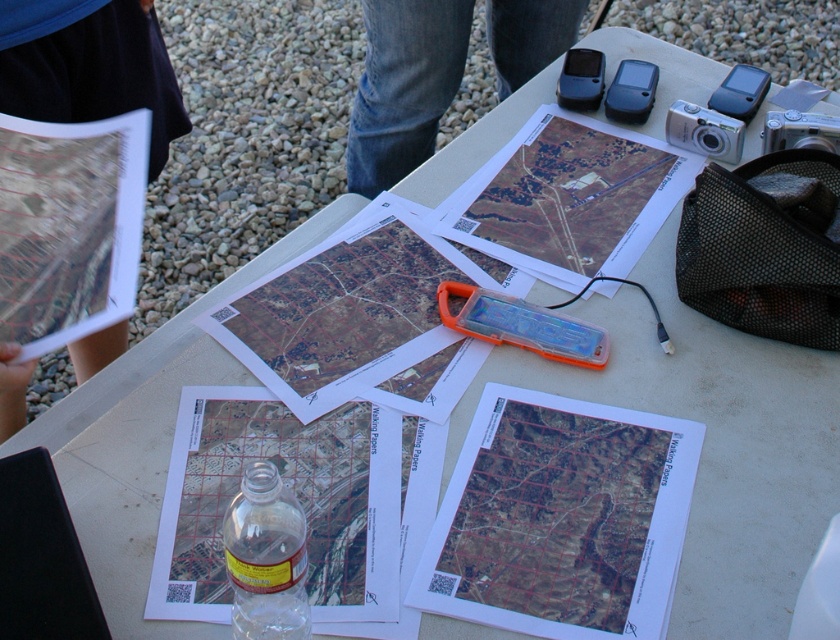
Describe the element at coordinates (571, 196) in the screenshot. I see `matte paper map at upper center` at that location.

Is matte paper map at upper center to the left of black fabric map at upper left from the viewer's perspective?

Incorrect, matte paper map at upper center is not on the left side of black fabric map at upper left.

Which is behind, point (588, 177) or point (151, 161)?

The point (151, 161) is behind.

Locate an element on the screen. The image size is (840, 640). matte paper map at upper center is located at coordinates tap(571, 196).

Does jeans at center appear over translucent orange case at center?

Indeed, jeans at center is positioned over translucent orange case at center.

Who is shorter, jeans at center or translucent orange case at center?

With less height is translucent orange case at center.

This screenshot has width=840, height=640. What do you see at coordinates (403, 86) in the screenshot?
I see `jeans at center` at bounding box center [403, 86].

This screenshot has height=640, width=840. I want to click on jeans at center, so click(403, 86).

Which is more to the right, matte paper map at center or black fabric map at upper left?

matte paper map at center

Which of these two, matte paper map at center or black fabric map at upper left, stands shorter?

Standing shorter between the two is matte paper map at center.

At what (x,y) coordinates should I click in order to perform the action: click on matte paper map at center. Please return your answer as a coordinate pair (x, y). The height and width of the screenshot is (640, 840). Looking at the image, I should click on (560, 518).

Identify the location of matte paper map at center. (560, 518).